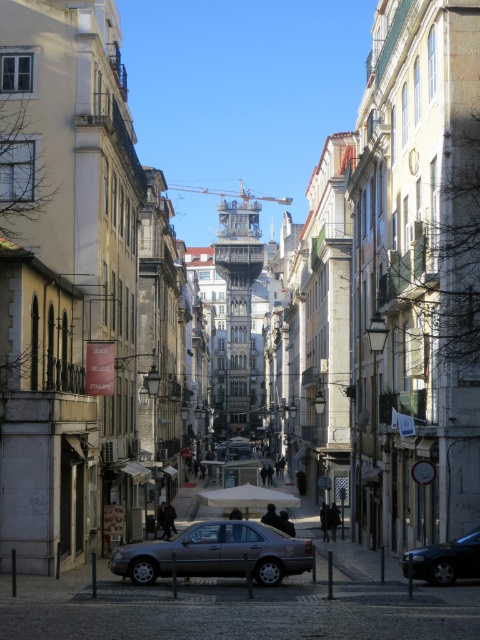
Question: Which of the following is the farthest from the observer?

Choices:
 (A) (128, 576)
 (B) (422, 556)

Answer: (A)

Question: Is metallic gray sedan at center in front of dark gray metallic car at lower right?

Choices:
 (A) no
 (B) yes

Answer: (B)

Question: Does metallic gray sedan at center appear over dark gray metallic car at lower right?

Choices:
 (A) yes
 (B) no

Answer: (A)

Question: From the image, what is the correct spatial relationship of metallic gray sedan at center in relation to dark gray metallic car at lower right?

Choices:
 (A) above
 (B) below

Answer: (A)

Question: Which of the following is the closest to the observer?

Choices:
 (A) dark gray metallic car at lower right
 (B) metallic gray sedan at center

Answer: (B)